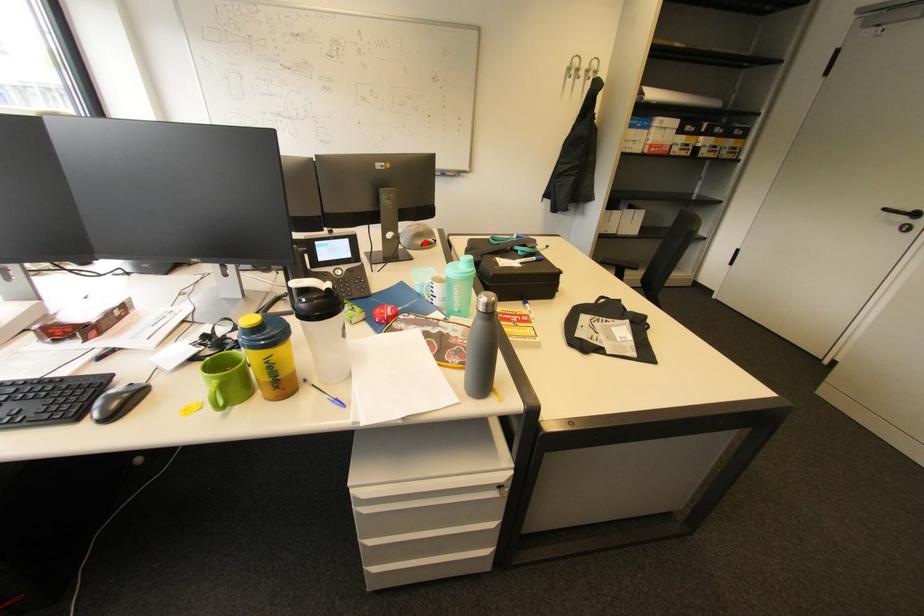
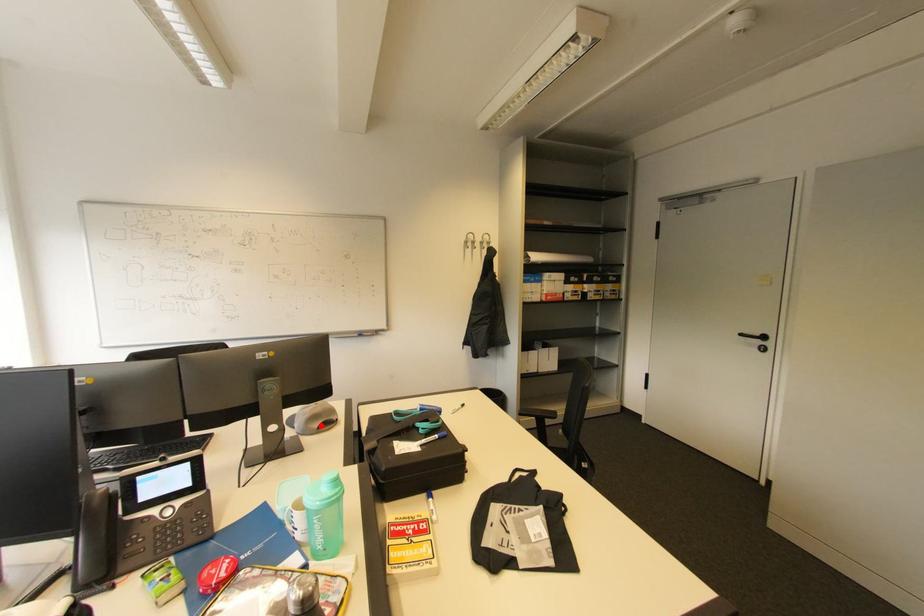
I am providing you with two images of the same scene from different viewpoints. A red point is marked on the first image and another point is marked on the second image. Does the point marked in image1 correspond to the same location as the one in image2?

Yes